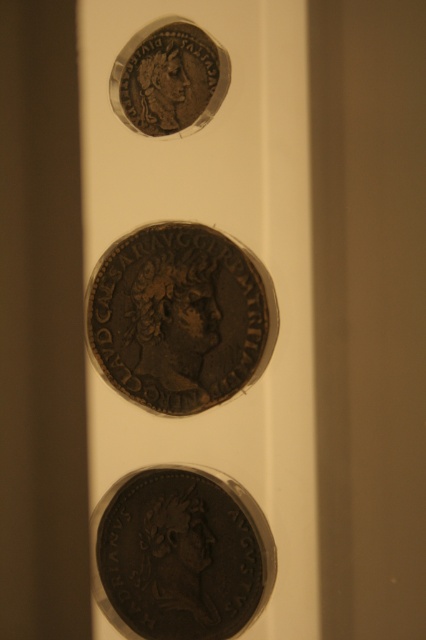
Question: Which point is closer to the camera?

Choices:
 (A) dark brown metallic coin at center
 (B) bronze coin at upper center

Answer: (A)

Question: Is dark brown metal coin at center behind bronze coin at upper center?

Choices:
 (A) no
 (B) yes

Answer: (A)

Question: Which of the following is the farthest from the observer?

Choices:
 (A) dark brown metallic coin at center
 (B) dark brown metal coin at center

Answer: (B)

Question: Can you confirm if dark brown metallic coin at center is positioned to the left of dark brown metal coin at center?

Choices:
 (A) no
 (B) yes

Answer: (B)

Question: Among these points, which one is farthest from the camera?

Choices:
 (A) (172, 44)
 (B) (115, 573)
 (C) (164, 288)

Answer: (B)

Question: Can you confirm if dark brown metallic coin at center is positioned to the right of dark brown metal coin at center?

Choices:
 (A) yes
 (B) no

Answer: (B)